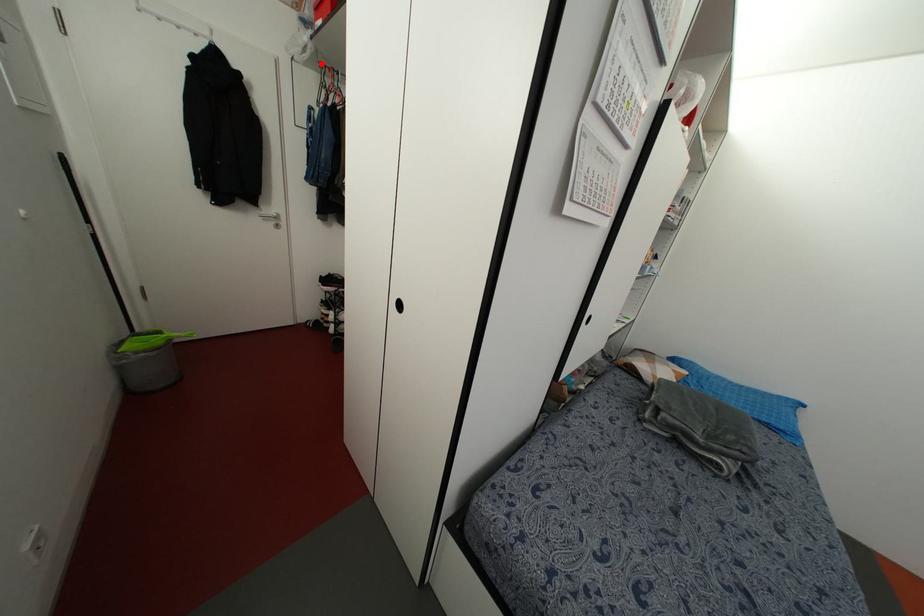
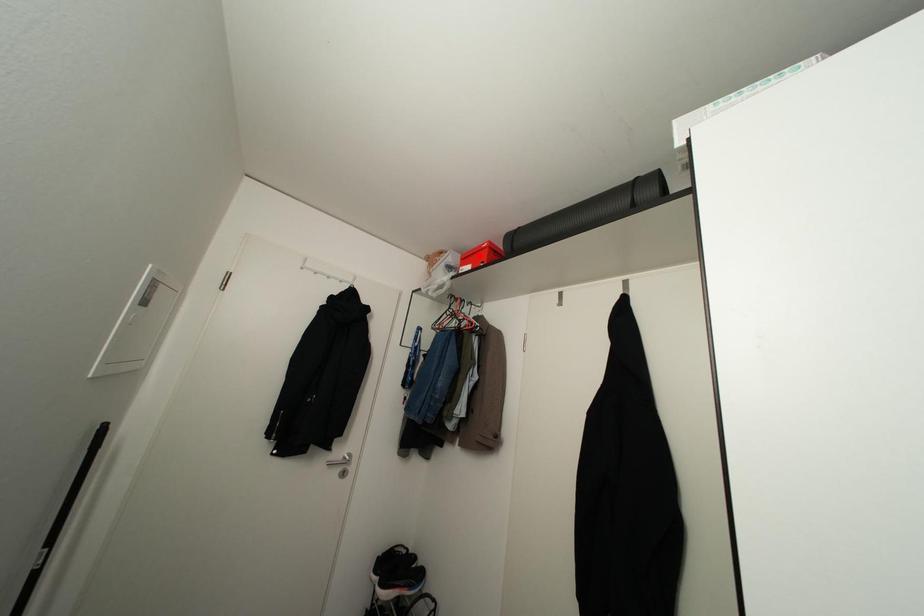
I am providing you with two images of the same scene from different viewpoints. A red point is marked on the first image and another point is marked on the second image. Is the red point in image1 aligned with the point shown in image2?

No